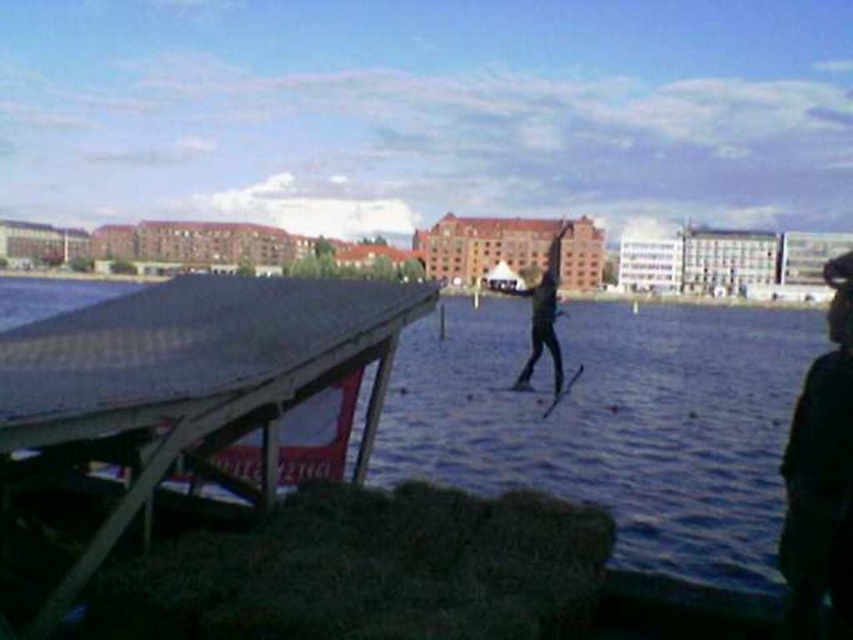
Which is more to the right, wooden dock at center or black matte skis at center?

black matte skis at center

At what (x,y) coordinates should I click in order to perform the action: click on wooden dock at center. Please return your answer as a coordinate pair (x, y). This screenshot has height=640, width=853. Looking at the image, I should click on (190, 378).

Does black matte skis at center come behind shiny black ski at center?

Yes, it is behind shiny black ski at center.

Is black matte skis at center thinner than shiny black ski at center?

In fact, black matte skis at center might be wider than shiny black ski at center.

The image size is (853, 640). Find the location of `black matte skis at center`. black matte skis at center is located at coordinates (543, 314).

Between wooden dock at center and shiny black ski at center, which one has less height?

Standing shorter between the two is shiny black ski at center.

Image resolution: width=853 pixels, height=640 pixels. What do you see at coordinates (190, 378) in the screenshot? I see `wooden dock at center` at bounding box center [190, 378].

This screenshot has height=640, width=853. I want to click on wooden dock at center, so click(x=190, y=378).